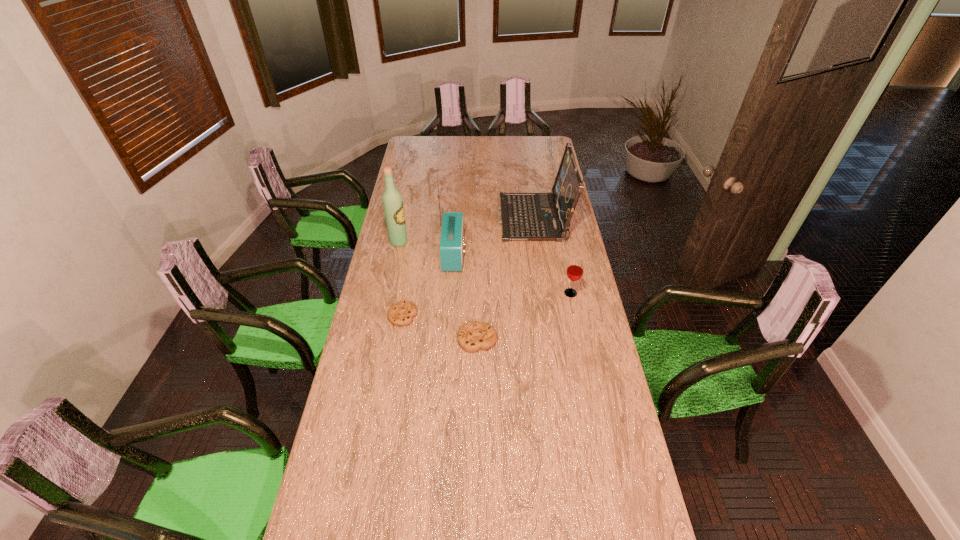
Where is `the shorter cookie`? The width and height of the screenshot is (960, 540). the shorter cookie is located at coordinates (401, 314).

Where is `the shortest object`? The height and width of the screenshot is (540, 960). the shortest object is located at coordinates (401, 314).

Find the location of a particular element. The height and width of the screenshot is (540, 960). the taller cookie is located at coordinates (472, 336).

Find the location of a particular element. the fifth tallest object is located at coordinates (472, 336).

Locate an element on the screen. The image size is (960, 540). the fourth shortest object is located at coordinates (525, 216).

Identify the location of wine bottle. This screenshot has height=540, width=960. (392, 201).

Image resolution: width=960 pixels, height=540 pixels. I want to click on radio receiver, so click(452, 232).

You are a GUI agent. You are given a task and a screenshot of the screen. Output one action in this format:
    pyautogui.click(x=<x>, y=<y>)
    Task: Click on the glass
    
    Given the screenshot: What is the action you would take?
    pyautogui.click(x=574, y=272)

What are the coordinates of `the third shortest object` in the screenshot? It's located at (574, 272).

Find the location of a particular element. The height and width of the screenshot is (540, 960). vacant space situated 0.070m on the back of the shorter cookie is located at coordinates (407, 292).